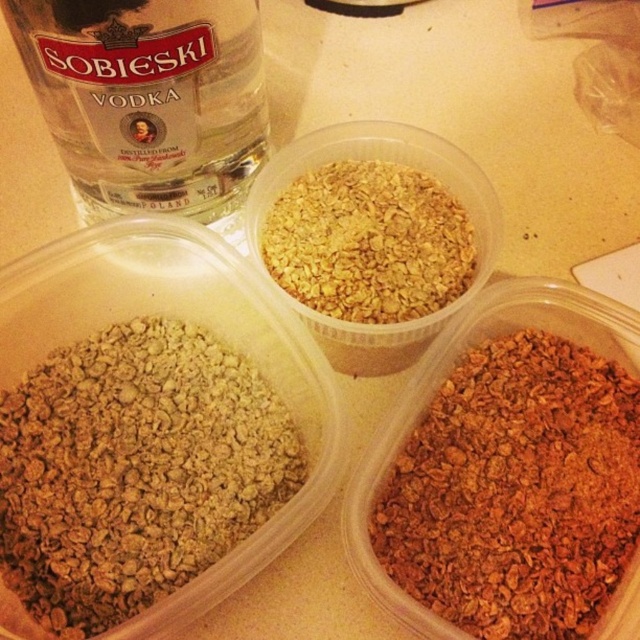
Question: Is matte glass bottle at upper left further to camera compared to golden granular cereal at center?

Choices:
 (A) yes
 (B) no

Answer: (B)

Question: Among these points, which one is nearest to the camera?

Choices:
 (A) (596, 566)
 (B) (227, 13)
 (C) (349, 211)

Answer: (A)

Question: Is matte glass bottle at upper left positioned in front of golden granular cereal at center?

Choices:
 (A) no
 (B) yes

Answer: (B)

Question: Among these points, which one is nearest to the camera?

Choices:
 (A) (609, 582)
 (B) (257, 160)
 (C) (134, 540)

Answer: (A)

Question: Which object is positioned farthest from the golden granular cereal at center?

Choices:
 (A) brown crunchy granola at lower right
 (B) matte glass bottle at upper left

Answer: (A)

Question: From the image, what is the correct spatial relationship of brown granular cereal at lower left in relation to brown crunchy granola at lower right?

Choices:
 (A) left
 (B) right

Answer: (A)